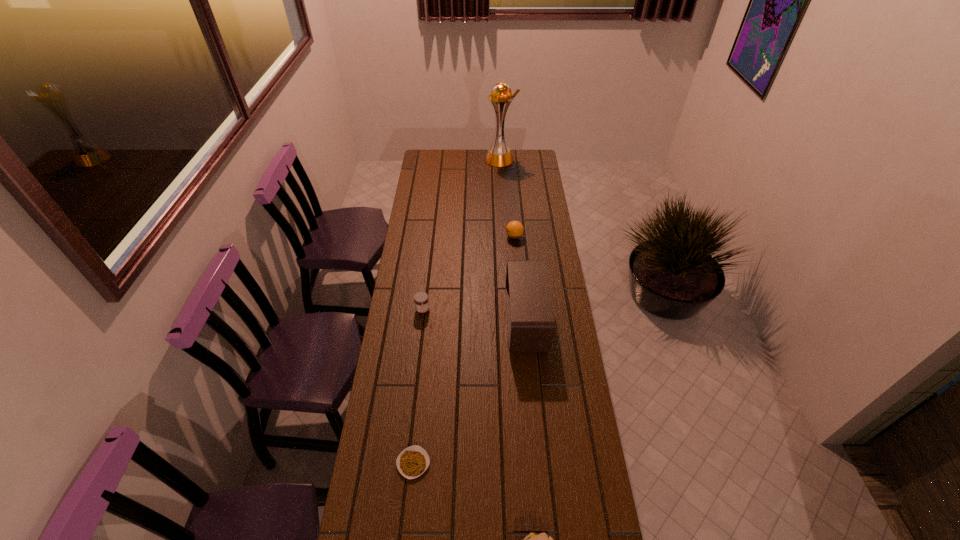
You are a GUI agent. You are given a task and a screenshot of the screen. Output one action in this format:
    pyautogui.click(x=<x>, y=<y>)
    Task: Click on the vacant space that is in between the tallest object and the second farthest object
    
    Given the screenshot: What is the action you would take?
    pyautogui.click(x=507, y=198)

Where is `vacant space in between the second tallest object and the shortest object`? Image resolution: width=960 pixels, height=540 pixels. vacant space in between the second tallest object and the shortest object is located at coordinates (469, 392).

Locate an element on the screen. unoccupied position between the ping-pong ball and the jam is located at coordinates (468, 273).

Where is `free spot between the jam and the legume`? Image resolution: width=960 pixels, height=540 pixels. free spot between the jam and the legume is located at coordinates (418, 387).

I want to click on empty space that is in between the second tallest object and the fifth farthest object, so click(469, 392).

You are a GUI agent. You are given a task and a screenshot of the screen. Output one action in this format:
    pyautogui.click(x=<x>, y=<y>)
    Task: Click on the object that ranks as the closest to the fifth farthest object
    
    Given the screenshot: What is the action you would take?
    pyautogui.click(x=533, y=539)

Where is `the closest object to the patty`? This screenshot has height=540, width=960. the closest object to the patty is located at coordinates (412, 462).

You are a GUI agent. You are given a task and a screenshot of the screen. Output one action in this format:
    pyautogui.click(x=<x>, y=<y>)
    Task: Click on the free spot that satisfies the following two spatial constraints: 1. on the side with brand of the ping-pong ball; 2. on the front side of the jam
    This screenshot has height=540, width=960.
    Given the screenshot: What is the action you would take?
    pyautogui.click(x=520, y=310)